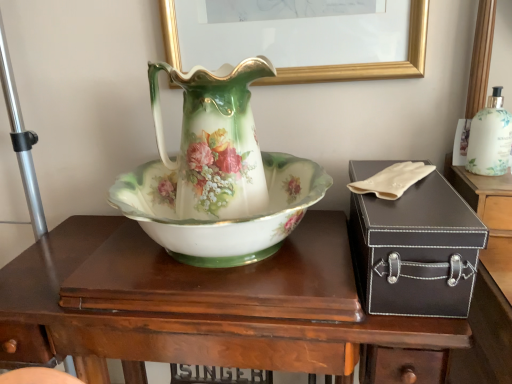
Question: Is porcelain floral vase at center oriented away from white glossy bottle at upper right?

Choices:
 (A) yes
 (B) no

Answer: (B)

Question: Is porcelain floral vase at center not close to white glossy bottle at upper right?

Choices:
 (A) yes
 (B) no

Answer: (B)

Question: Is porcelain floral vase at center wider than white glossy bottle at upper right?

Choices:
 (A) yes
 (B) no

Answer: (A)

Question: From a real-world perspective, is porcelain floral vase at center located beneath white glossy bottle at upper right?

Choices:
 (A) yes
 (B) no

Answer: (B)

Question: Can you confirm if porcelain floral vase at center is positioned to the left of white glossy bottle at upper right?

Choices:
 (A) yes
 (B) no

Answer: (A)

Question: Is white glossy bottle at upper right wider or thinner than black leather suitcase at right?

Choices:
 (A) thin
 (B) wide

Answer: (A)

Question: From the image's perspective, is white glossy bottle at upper right located above or below black leather suitcase at right?

Choices:
 (A) below
 (B) above

Answer: (B)

Question: Looking at the image, does white glossy bottle at upper right seem bigger or smaller compared to black leather suitcase at right?

Choices:
 (A) small
 (B) big

Answer: (A)

Question: Do you think white glossy bottle at upper right is within black leather suitcase at right, or outside of it?

Choices:
 (A) outside
 (B) inside

Answer: (A)

Question: Considering the positions of black leather suitcase at right and wooden desk at center in the image, is black leather suitcase at right bigger or smaller than wooden desk at center?

Choices:
 (A) small
 (B) big

Answer: (A)

Question: Does point (467, 309) appear closer or farther from the camera than point (332, 309)?

Choices:
 (A) farther
 (B) closer

Answer: (B)

Question: Considering the positions of black leather suitcase at right and wooden desk at center in the image, is black leather suitcase at right taller or shorter than wooden desk at center?

Choices:
 (A) short
 (B) tall

Answer: (A)

Question: Looking at their shapes, would you say black leather suitcase at right is wider or thinner than wooden desk at center?

Choices:
 (A) wide
 (B) thin

Answer: (B)

Question: Is point (394, 233) positioned closer to the camera than point (480, 150)?

Choices:
 (A) closer
 (B) farther

Answer: (A)

Question: In terms of width, does black leather suitcase at right look wider or thinner when compared to white glossy bottle at upper right?

Choices:
 (A) thin
 (B) wide

Answer: (B)